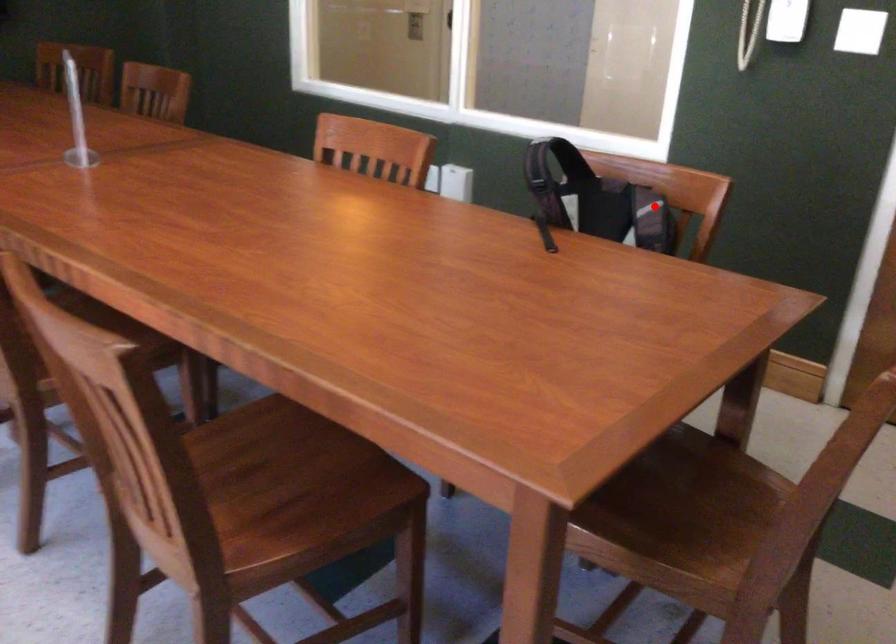
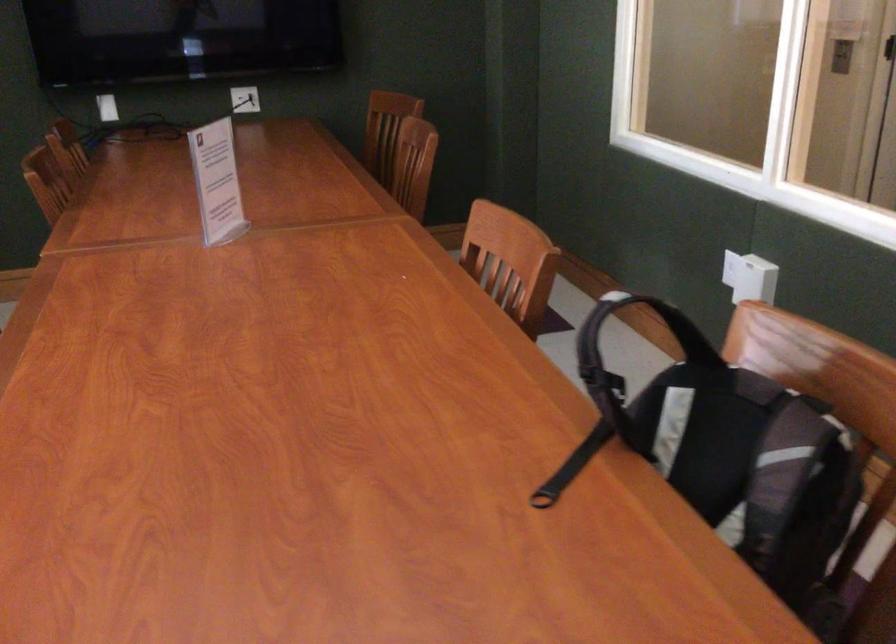
Question: I am providing you with two images of the same scene from different viewpoints. In image1, a red point is highlighted. Considering the same 3D point in image2, which of the following is correct?

Choices:
 (A) It is closer
 (B) It is farther

Answer: (A)